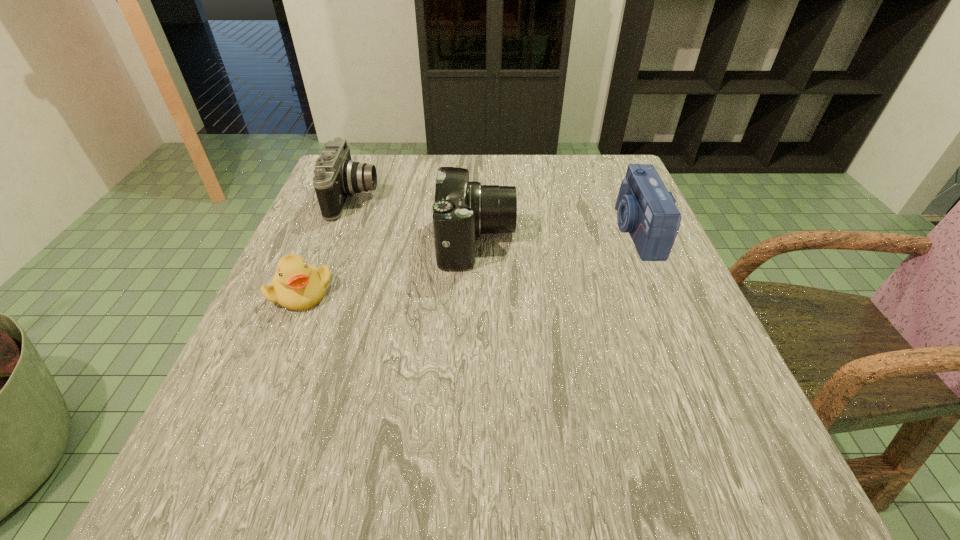
I want to click on camera present at the left edge, so click(x=336, y=177).

Find the location of `duckling that is positioned at the left edge`. duckling that is positioned at the left edge is located at coordinates (297, 285).

Identify the location of object that is at the right edge. Image resolution: width=960 pixels, height=540 pixels. (646, 210).

The width and height of the screenshot is (960, 540). In order to click on object located at the far left corner in this screenshot , I will do `click(336, 177)`.

This screenshot has width=960, height=540. What are the coordinates of `object present at the far right corner` in the screenshot? It's located at (646, 210).

The width and height of the screenshot is (960, 540). Find the location of `blank space at the far edge`. blank space at the far edge is located at coordinates (564, 178).

You are a GUI agent. You are given a task and a screenshot of the screen. Output one action in this format:
    pyautogui.click(x=<x>, y=<y>)
    Task: Click on the free region at the near edge of the desktop
    The width and height of the screenshot is (960, 540).
    Given the screenshot: What is the action you would take?
    pyautogui.click(x=378, y=487)

You are a GUI agent. You are given a task and a screenshot of the screen. Output one action in this format:
    pyautogui.click(x=<x>, y=<y>)
    Task: Click on the vacant space at the left edge
    
    Given the screenshot: What is the action you would take?
    pyautogui.click(x=334, y=222)

Image resolution: width=960 pixels, height=540 pixels. In the image, there is a desktop. Identify the location of vacant space at the right edge. (649, 261).

This screenshot has height=540, width=960. Identify the location of free space between the shortest object and the leftmost camera. (328, 245).